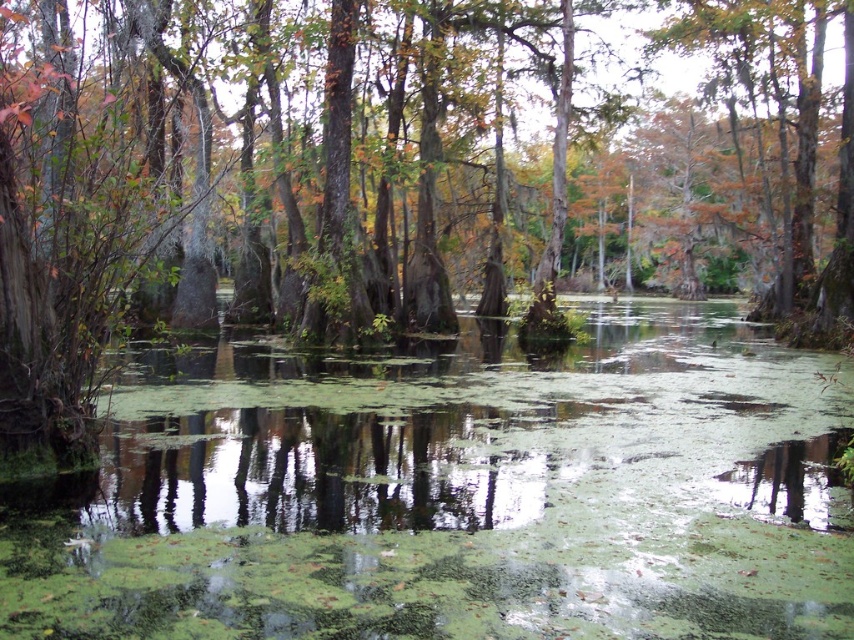
Who is more forward, (740, 499) or (349, 317)?

Point (740, 499) is in front.

You are a GUI agent. You are given a task and a screenshot of the screen. Output one action in this format:
    pyautogui.click(x=<x>, y=<y>)
    Task: Click on the green algae water at center
    Image resolution: width=854 pixels, height=640 pixels.
    Given the screenshot: What is the action you would take?
    pyautogui.click(x=453, y=493)